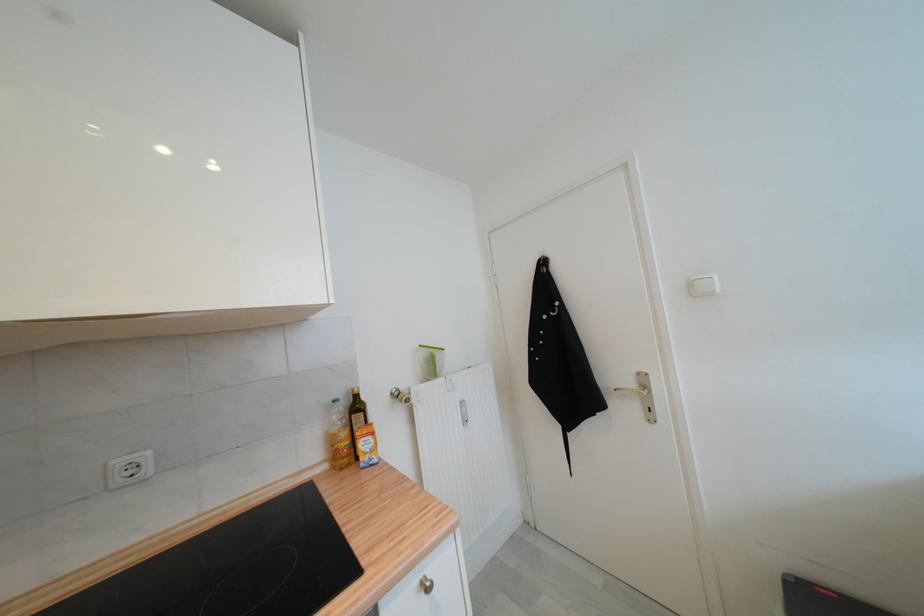
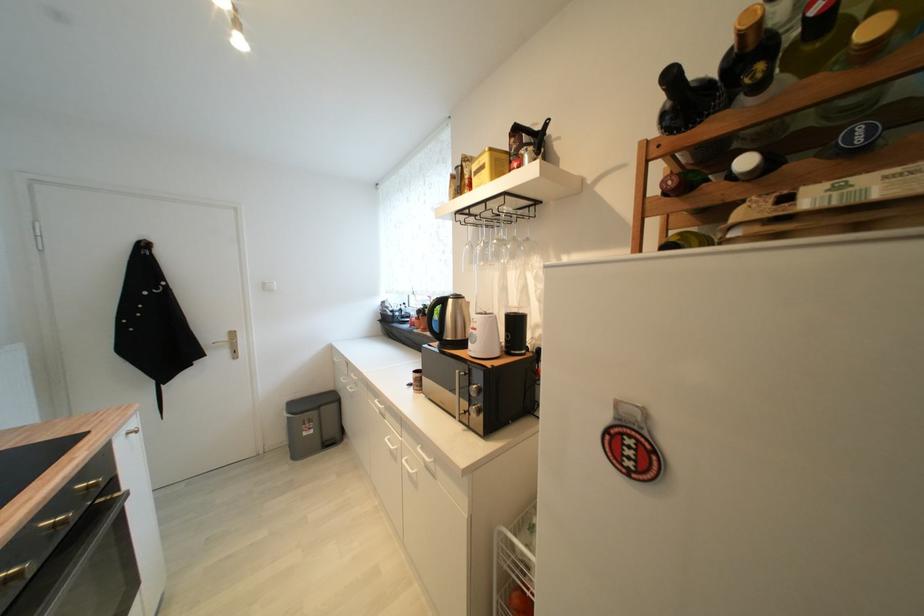
The point at (637, 386) is marked in the first image. Where is the corresponding point in the second image?

(229, 339)